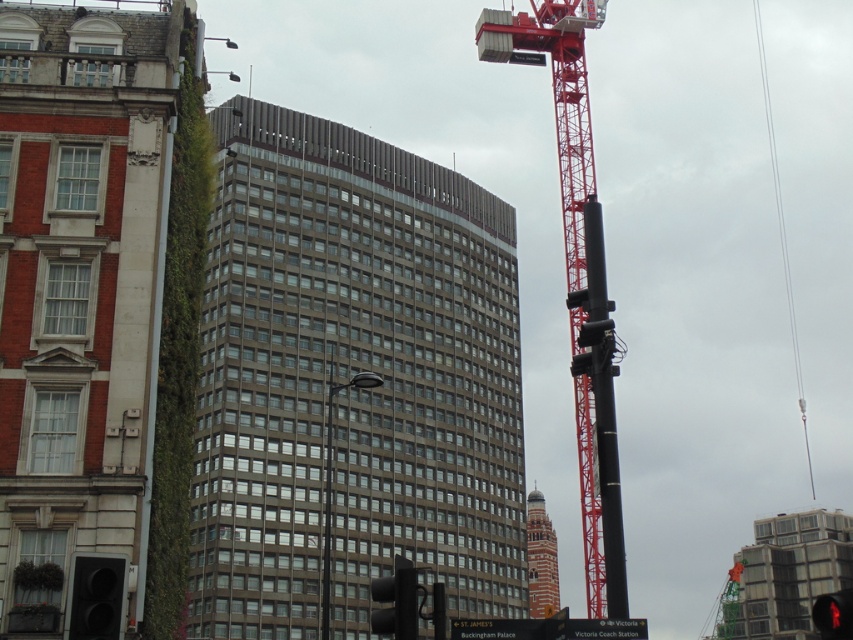
Consider the image. You are a delivery driver approaching the intersection shown in the image. You see the black matte traffic light at lower left and the black plastic traffic light at lower center. Which traffic light has a larger diameter?

The black plastic traffic light at lower center has a larger diameter than the black matte traffic light at lower left.

You are a city planner reviewing this urban layout. You need to determine the spatial relationship between the brown glass building at center and the black matte pole at right. Based on the scene, which object is positioned lower in the image?

The brown glass building at center is located below the black matte pole at right, so it is positioned lower in the image.

You are standing at the origin point of the coordinate system. You want to move towards the brown glass building at center. What are the coordinates you need to move towards?

The coordinates you need to move towards are 0.592 in the x direction and 0.413 in the y direction.